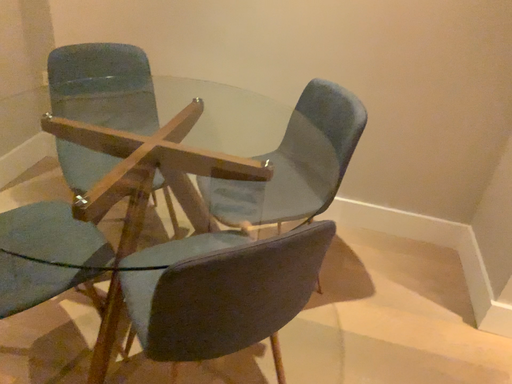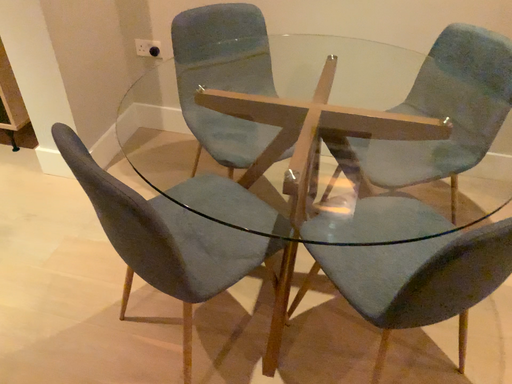
Question: How did the camera likely rotate when shooting the video?

Choices:
 (A) rotated upward
 (B) rotated downward

Answer: (B)